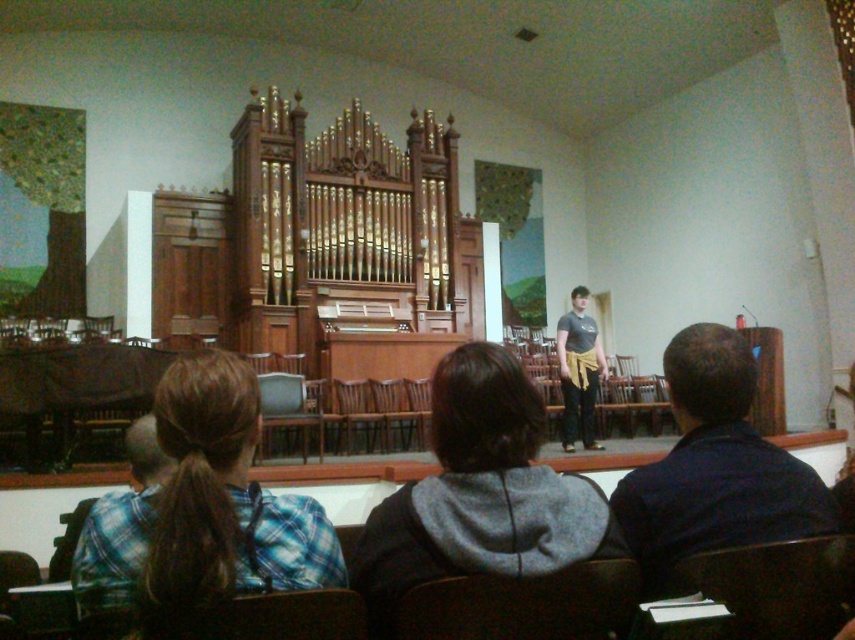
You are an event planner setting up for a small concert. You need to ensure the performer in the dark blue shirt at center has enough space to move freely. Is the dark brown wood chair at lower right blocking their path?

The dark brown wood chair at lower right is behind the dark blue shirt at center, so it is not blocking their path and the performer has enough space to move freely.

You are an event organizer planning to set up a microphone stand between the dark brown wood chair at lower right and the plaid fabric shirt at lower left. Considering their heights, which object should the microphone stand be placed closer to to avoid blocking the view of someone sitting in the chair?

The microphone stand should be placed closer to the plaid fabric shirt at lower left because the dark brown wood chair at lower right is taller. Placing it closer to the shorter object minimizes the chance of blocking the view from the chair.

You are standing at the back of the stage and want to take a photo of the gray fleece hoodie at center. If your camera has a maximum focus range of 6 feet, will you be able to capture a clear photo?

The gray fleece hoodie at center is 6.55 feet away from the camera, which exceeds the camera maximum focus range of 6 feet. Therefore, you won let capture a clear photo.